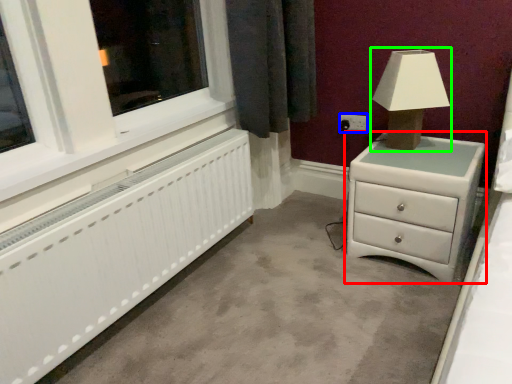
Question: Estimate the real-world distances between objects in this image. Which object is farther from chest of drawers (highlighted by a red box), electric outlet (highlighted by a blue box) or table lamp (highlighted by a green box)?

Choices:
 (A) electric outlet
 (B) table lamp

Answer: (A)